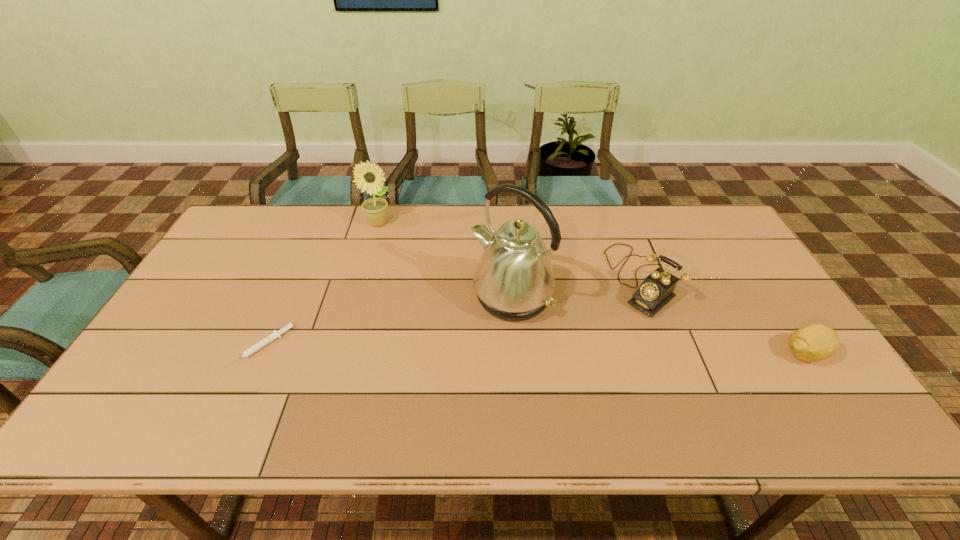
Find the location of a particular element. The width and height of the screenshot is (960, 540). free space located 0.220m on the right of the shortest object is located at coordinates (373, 347).

Identify the location of free space located 0.340m on the face of the second tallest object. (431, 289).

The height and width of the screenshot is (540, 960). I want to click on vacant point located on the face of the second tallest object, so click(x=416, y=270).

Locate an element on the screen. Image resolution: width=960 pixels, height=540 pixels. free space located on the face of the second tallest object is located at coordinates (394, 240).

Locate an element on the screen. This screenshot has height=540, width=960. vacant space located on the dial of the second object from right to left is located at coordinates (543, 376).

Find the location of a particular element. The image size is (960, 540). vacant area situated on the dial of the second object from right to left is located at coordinates tap(578, 347).

Where is `vacant region located 0.380m on the dial of the second object from right to left`? The image size is (960, 540). vacant region located 0.380m on the dial of the second object from right to left is located at coordinates (536, 383).

In order to click on vacant space located from the spout of the tallest object in this screenshot , I will do `click(458, 348)`.

You are a GUI agent. You are given a task and a screenshot of the screen. Output one action in this format:
    pyautogui.click(x=<x>, y=<y>)
    Task: Click on the vacant space located 0.140m from the spout of the tallest object
    Image resolution: width=960 pixels, height=540 pixels.
    Given the screenshot: What is the action you would take?
    pyautogui.click(x=453, y=353)

The height and width of the screenshot is (540, 960). I want to click on vacant space positioned from the spout of the tallest object, so click(x=464, y=343).